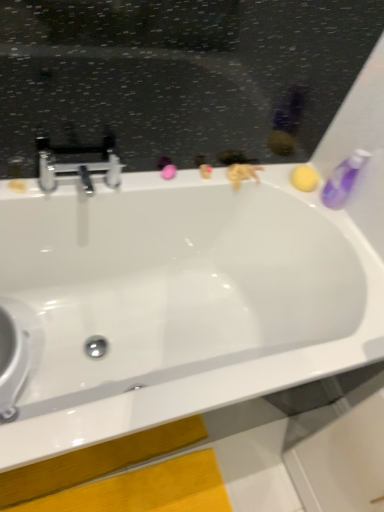
Question: From the image's perspective, is white glossy bathtub at center located above purple translucent bottle at upper right?

Choices:
 (A) no
 (B) yes

Answer: (A)

Question: Is white glossy bathtub at center looking in the opposite direction of purple translucent bottle at upper right?

Choices:
 (A) no
 (B) yes

Answer: (A)

Question: Is white glossy bathtub at center further to camera compared to purple translucent bottle at upper right?

Choices:
 (A) yes
 (B) no

Answer: (B)

Question: From a real-world perspective, is white glossy bathtub at center over purple translucent bottle at upper right?

Choices:
 (A) yes
 (B) no

Answer: (B)

Question: From the image's perspective, is white glossy bathtub at center located beneath purple translucent bottle at upper right?

Choices:
 (A) yes
 (B) no

Answer: (A)

Question: Does white glossy bathtub at center have a lesser height compared to purple translucent bottle at upper right?

Choices:
 (A) no
 (B) yes

Answer: (A)

Question: Is purple translucent bottle at upper right bigger than polished chrome faucet at upper left?

Choices:
 (A) yes
 (B) no

Answer: (B)

Question: Is purple translucent bottle at upper right behind polished chrome faucet at upper left?

Choices:
 (A) yes
 (B) no

Answer: (A)

Question: Can you confirm if purple translucent bottle at upper right is shorter than polished chrome faucet at upper left?

Choices:
 (A) no
 (B) yes

Answer: (A)

Question: Would you say purple translucent bottle at upper right is outside polished chrome faucet at upper left?

Choices:
 (A) yes
 (B) no

Answer: (A)

Question: Is purple translucent bottle at upper right oriented away from polished chrome faucet at upper left?

Choices:
 (A) no
 (B) yes

Answer: (A)

Question: From the image's perspective, would you say purple translucent bottle at upper right is positioned over polished chrome faucet at upper left?

Choices:
 (A) yes
 (B) no

Answer: (A)

Question: Does white glossy bathtub at center appear on the left side of polished chrome faucet at upper left?

Choices:
 (A) yes
 (B) no

Answer: (B)